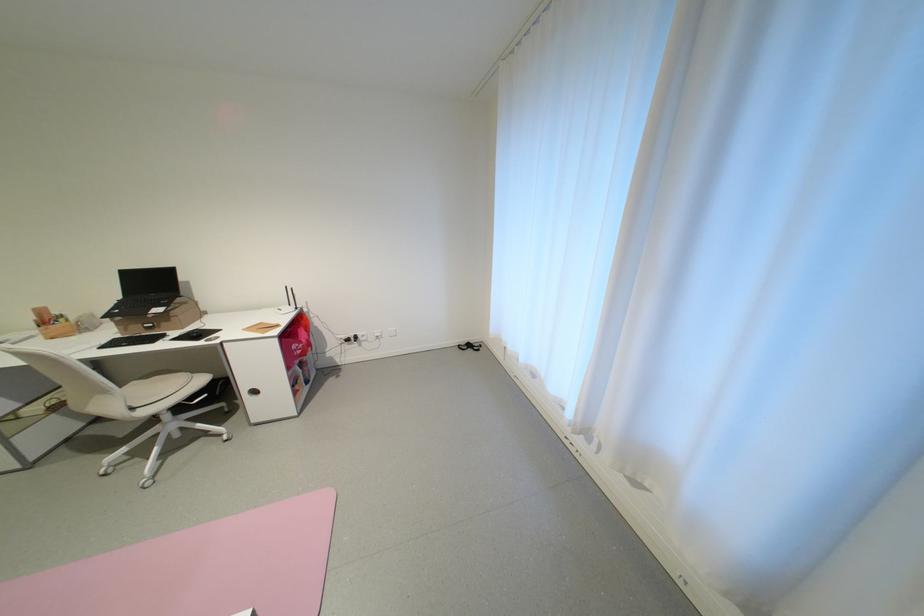
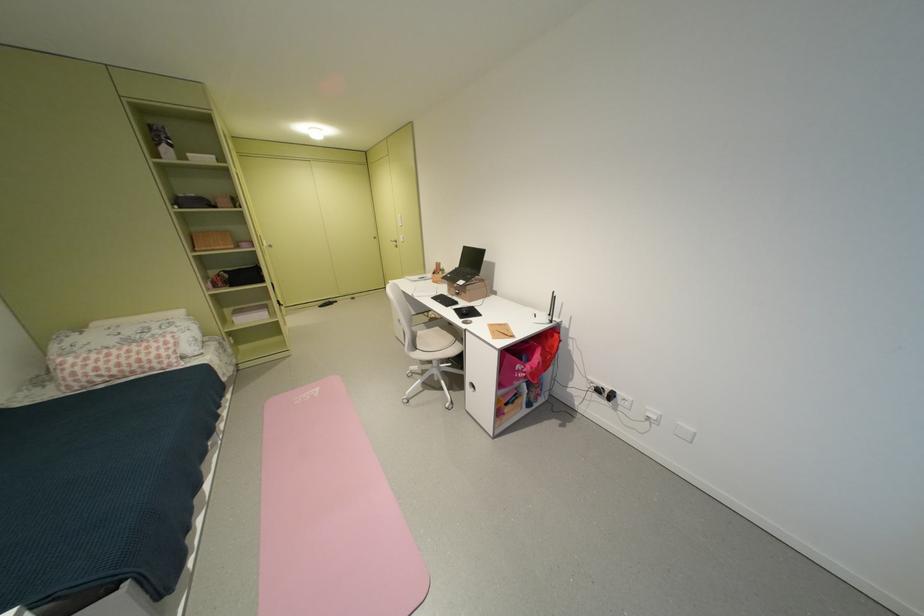
Find the pixel in the second image that matches pixel 71 321 in the first image.

(450, 274)